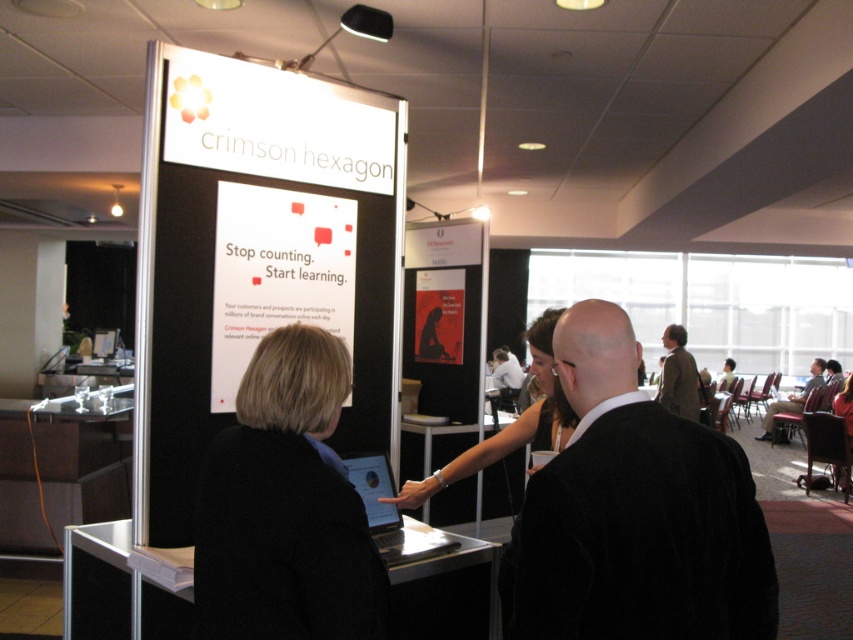
Can you confirm if black velvet jacket at center is positioned above light brown leather jacket at right?

Indeed, black velvet jacket at center is positioned over light brown leather jacket at right.

Which is behind, point (692, 449) or point (691, 412)?

The point (691, 412) is behind.

Describe the element at coordinates (635, 513) in the screenshot. The image size is (853, 640). I see `black velvet jacket at center` at that location.

At what (x,y) coordinates should I click in order to perform the action: click on black velvet jacket at center. Please return your answer as a coordinate pair (x, y). Looking at the image, I should click on (635, 513).

From the picture: Who is positioned more to the left, black velvet jacket at center or silver metallic laptop at center?

Positioned to the left is silver metallic laptop at center.

Does black velvet jacket at center appear over silver metallic laptop at center?

Yes, black velvet jacket at center is above silver metallic laptop at center.

Identify the location of black velvet jacket at center. (635, 513).

Does silver metallic laptop at center have a smaller size compared to light brown leather jacket at right?

Correct, silver metallic laptop at center occupies less space than light brown leather jacket at right.

The height and width of the screenshot is (640, 853). What are the coordinates of `silver metallic laptop at center` in the screenshot? It's located at (392, 513).

What are the coordinates of `silver metallic laptop at center` in the screenshot? It's located at (392, 513).

Locate an element on the screen. The height and width of the screenshot is (640, 853). silver metallic laptop at center is located at coordinates (392, 513).